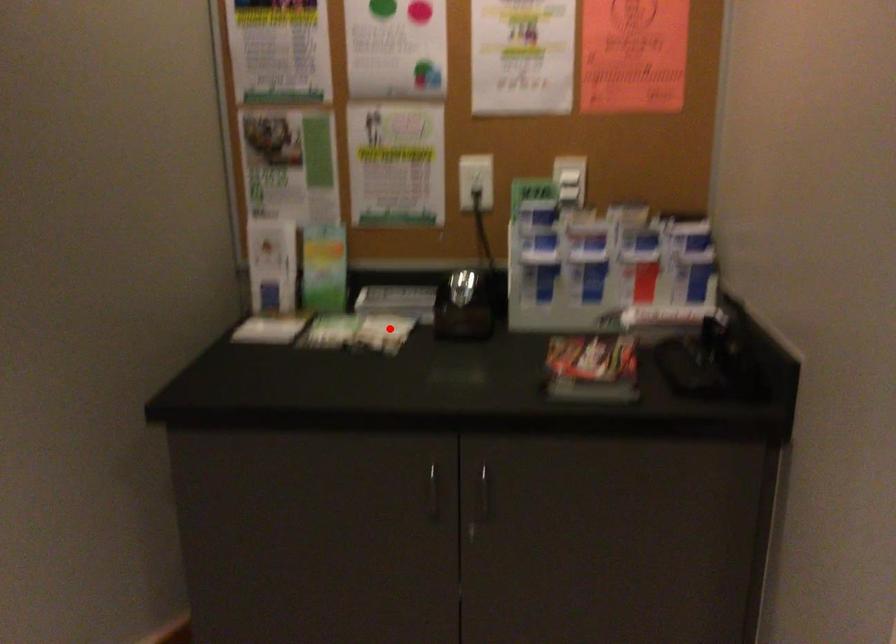
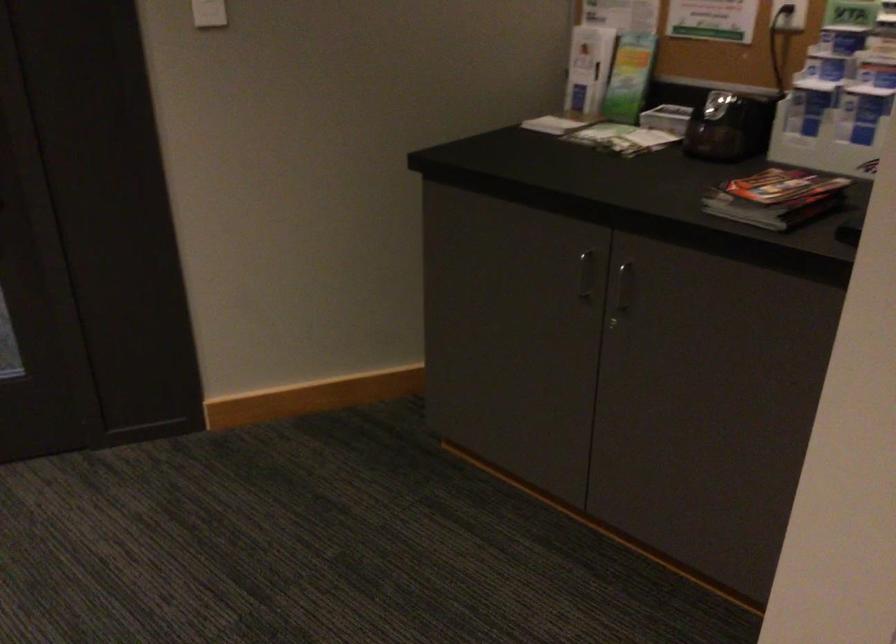
Where in the second image is the point corresponding to the highlighted location from the first image?

(647, 140)